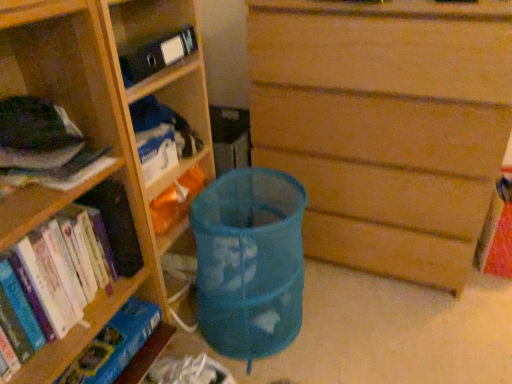
The image size is (512, 384). What do you see at coordinates (121, 347) in the screenshot?
I see `blue cardboard bookshelf at lower left, which is the first shelf from bottom to top` at bounding box center [121, 347].

The height and width of the screenshot is (384, 512). What do you see at coordinates (385, 126) in the screenshot? I see `wooden chest of drawers at center` at bounding box center [385, 126].

Find the location of a particular element. The image size is (512, 384). hardcover books at left, the 1th book ordered from the bottom is located at coordinates (68, 266).

Describe the element at coordinates (44, 146) in the screenshot. I see `hardcover book at left, placed as the second book when sorted from bottom to top` at that location.

The width and height of the screenshot is (512, 384). I want to click on wooden bookshelf at left, marked as the 1th shelf in a top-to-bottom arrangement, so click(x=98, y=132).

Is point (301, 248) behind point (70, 321)?

Yes, it is behind point (70, 321).

Which object is more forward, blue mesh bag at center or hardcover books at left, the 1th book ordered from the bottom?

hardcover books at left, the 1th book ordered from the bottom, is closer to the camera.

From a real-world perspective, is blue mesh bag at center located beneath hardcover books at left, the 2th book when ordered from top to bottom?

Yes, from a real-world perspective, blue mesh bag at center is under hardcover books at left, the 2th book when ordered from top to bottom.

Is blue mesh bag at center bigger or smaller than hardcover books at left, the 1th book ordered from the bottom?

Considering their sizes, blue mesh bag at center takes up more space than hardcover books at left, the 1th book ordered from the bottom.

Is hardcover books at left, the 2th book when ordered from top to bottom, aimed at hardcover book at left, which is the first book from top to bottom?

No.

Considering the relative positions of hardcover books at left, the 2th book when ordered from top to bottom, and hardcover book at left, placed as the second book when sorted from bottom to top, in the image provided, is hardcover books at left, the 2th book when ordered from top to bottom, to the right of hardcover book at left, placed as the second book when sorted from bottom to top, from the viewer's perspective?

Incorrect, hardcover books at left, the 2th book when ordered from top to bottom, is not on the right side of hardcover book at left, placed as the second book when sorted from bottom to top.

Is hardcover books at left, the 2th book when ordered from top to bottom, placed right next to hardcover book at left, placed as the second book when sorted from bottom to top?

No, hardcover books at left, the 2th book when ordered from top to bottom, is not with hardcover book at left, placed as the second book when sorted from bottom to top.

Does point (46, 282) come farther from viewer compared to point (71, 124)?

No, it is in front of (71, 124).

From the image's perspective, is wooden bookshelf at left, marked as the 1th shelf in a top-to-bottom arrangement, located above or below wooden chest of drawers at center?

wooden bookshelf at left, marked as the 1th shelf in a top-to-bottom arrangement, is situated lower than wooden chest of drawers at center in the image.

Is wooden bookshelf at left, marked as the 1th shelf in a top-to-bottom arrangement, turned away from wooden chest of drawers at center?

wooden bookshelf at left, marked as the 1th shelf in a top-to-bottom arrangement, does not have its back to wooden chest of drawers at center.

Which is closer to the camera, (25,88) or (452,234)?

Point (25,88) appears to be closer to the viewer than point (452,234).

How distant is wooden bookshelf at left, marked as the 2th shelf in a bottom-to-top arrangement, from wooden chest of drawers at center?

They are 21.74 inches apart.

From a real-world perspective, is hardcover books at left, the 2th book when ordered from top to bottom, positioned over blue mesh bag at center based on gravity?

Correct, in the physical world, hardcover books at left, the 2th book when ordered from top to bottom, is higher than blue mesh bag at center.

Is the position of hardcover books at left, the 2th book when ordered from top to bottom, less distant than that of blue mesh bag at center?

Yes, it is.

Which is closer to the camera, (73, 237) or (210, 191)?

Point (73, 237) appears to be closer to the viewer than point (210, 191).

From the image's perspective, which is above, blue cardboard bookshelf at lower left, marked as the 2th shelf in a top-to-bottom arrangement, or wooden bookshelf at left, marked as the 2th shelf in a bottom-to-top arrangement?

wooden bookshelf at left, marked as the 2th shelf in a bottom-to-top arrangement, appears higher in the image.

Does blue cardboard bookshelf at lower left, which is the first shelf from bottom to top, have a greater height compared to wooden bookshelf at left, marked as the 2th shelf in a bottom-to-top arrangement?

Incorrect, the height of blue cardboard bookshelf at lower left, which is the first shelf from bottom to top, is not larger of that of wooden bookshelf at left, marked as the 2th shelf in a bottom-to-top arrangement.

What's the angular difference between blue cardboard bookshelf at lower left, which is the first shelf from bottom to top, and wooden bookshelf at left, marked as the 2th shelf in a bottom-to-top arrangement,'s facing directions?

There is a 2.88-degree angle between the facing directions of blue cardboard bookshelf at lower left, which is the first shelf from bottom to top, and wooden bookshelf at left, marked as the 2th shelf in a bottom-to-top arrangement.

From a real-world perspective, is blue cardboard bookshelf at lower left, marked as the 2th shelf in a top-to-bottom arrangement, physically located above or below wooden bookshelf at left, marked as the 2th shelf in a bottom-to-top arrangement?

blue cardboard bookshelf at lower left, marked as the 2th shelf in a top-to-bottom arrangement, is below wooden bookshelf at left, marked as the 2th shelf in a bottom-to-top arrangement.

Could you measure the distance between wooden chest of drawers at center and hardcover book at left, which is the first book from top to bottom?

wooden chest of drawers at center is 32.10 inches away from hardcover book at left, which is the first book from top to bottom.

What's the angular difference between wooden chest of drawers at center and hardcover book at left, placed as the second book when sorted from bottom to top,'s facing directions?

The facing directions of wooden chest of drawers at center and hardcover book at left, placed as the second book when sorted from bottom to top, are 88 degrees apart.

From a real-world perspective, is wooden chest of drawers at center above or below hardcover book at left, placed as the second book when sorted from bottom to top?

wooden chest of drawers at center is situated lower than hardcover book at left, placed as the second book when sorted from bottom to top, in the real world.

Which of these two, wooden chest of drawers at center or hardcover book at left, which is the first book from top to bottom, stands shorter?

hardcover book at left, which is the first book from top to bottom.

Which is in front, point (122, 360) or point (277, 265)?

The point (122, 360) is more forward.

Between blue cardboard bookshelf at lower left, marked as the 2th shelf in a top-to-bottom arrangement, and blue mesh bag at center, which one has less height?

Standing shorter between the two is blue cardboard bookshelf at lower left, marked as the 2th shelf in a top-to-bottom arrangement.

Is blue cardboard bookshelf at lower left, which is the first shelf from bottom to top, facing towards blue mesh bag at center?

No.

Is blue cardboard bookshelf at lower left, which is the first shelf from bottom to top, placed right next to blue mesh bag at center?

blue cardboard bookshelf at lower left, which is the first shelf from bottom to top, is not next to blue mesh bag at center, and they're not touching.

The width and height of the screenshot is (512, 384). I want to click on waste container behind the hardcover books at left, the 2th book when ordered from top to bottom, so click(249, 262).

Find the location of a particular element. The image size is (512, 384). book that appears above the hardcover books at left, the 2th book when ordered from top to bottom (from a real-world perspective) is located at coordinates (44, 146).

Estimate the real-world distances between objects in this image. Which object is closer to wooden chest of drawers at center, blue cardboard bookshelf at lower left, which is the first shelf from bottom to top, or hardcover books at left, the 2th book when ordered from top to bottom?

hardcover books at left, the 2th book when ordered from top to bottom.

Looking at the image, which one is located further to hardcover book at left, placed as the second book when sorted from bottom to top, blue cardboard bookshelf at lower left, marked as the 2th shelf in a top-to-bottom arrangement, or hardcover books at left, the 2th book when ordered from top to bottom?

Among the two, blue cardboard bookshelf at lower left, marked as the 2th shelf in a top-to-bottom arrangement, is located further to hardcover book at left, placed as the second book when sorted from bottom to top.

When comparing their distances from hardcover books at left, the 1th book ordered from the bottom, does blue mesh bag at center or wooden bookshelf at left, marked as the 2th shelf in a bottom-to-top arrangement, seem further?

Based on the image, blue mesh bag at center appears to be further to hardcover books at left, the 1th book ordered from the bottom.

Based on their spatial positions, is hardcover book at left, placed as the second book when sorted from bottom to top, or wooden bookshelf at left, marked as the 1th shelf in a top-to-bottom arrangement, further from wooden chest of drawers at center?

hardcover book at left, placed as the second book when sorted from bottom to top.

Which object lies nearer to the anchor point wooden bookshelf at left, marked as the 1th shelf in a top-to-bottom arrangement, blue cardboard bookshelf at lower left, marked as the 2th shelf in a top-to-bottom arrangement, or hardcover books at left, the 2th book when ordered from top to bottom?

hardcover books at left, the 2th book when ordered from top to bottom.

Based on the photo, when comparing their distances from blue mesh bag at center, does blue cardboard bookshelf at lower left, which is the first shelf from bottom to top, or hardcover books at left, the 1th book ordered from the bottom, seem further?

The object further to blue mesh bag at center is hardcover books at left, the 1th book ordered from the bottom.

Looking at the image, which one is located closer to wooden bookshelf at left, marked as the 2th shelf in a bottom-to-top arrangement, wooden chest of drawers at center or hardcover books at left, the 2th book when ordered from top to bottom?

Among the two, hardcover books at left, the 2th book when ordered from top to bottom, is located nearer to wooden bookshelf at left, marked as the 2th shelf in a bottom-to-top arrangement.

Estimate the real-world distances between objects in this image. Which object is further from hardcover books at left, the 2th book when ordered from top to bottom, blue mesh bag at center or blue cardboard bookshelf at lower left, marked as the 2th shelf in a top-to-bottom arrangement?

The object further to hardcover books at left, the 2th book when ordered from top to bottom, is blue mesh bag at center.

Find the location of a particular element. This screenshot has width=512, height=384. waste container between wooden bookshelf at left, marked as the 2th shelf in a bottom-to-top arrangement, and wooden chest of drawers at center, in the horizontal direction is located at coordinates (249, 262).

This screenshot has height=384, width=512. I want to click on waste container between hardcover book at left, which is the first book from top to bottom, and blue cardboard bookshelf at lower left, which is the first shelf from bottom to top, vertically, so click(x=249, y=262).

You are a GUI agent. You are given a task and a screenshot of the screen. Output one action in this format:
    pyautogui.click(x=<x>, y=<y>)
    Task: Click on the waste container between hardcover books at left, the 1th book ordered from the bottom, and wooden chest of drawers at center from left to right
    
    Given the screenshot: What is the action you would take?
    pyautogui.click(x=249, y=262)

This screenshot has height=384, width=512. I want to click on shelf between hardcover book at left, which is the first book from top to bottom, and hardcover books at left, the 2th book when ordered from top to bottom, from top to bottom, so click(98, 132).